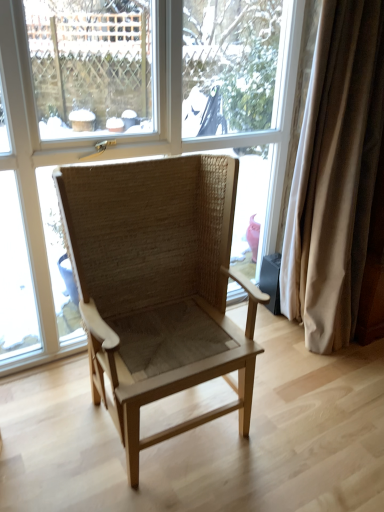
Question: Considering the positions of point (291, 240) and point (92, 244), is point (291, 240) closer or farther from the camera than point (92, 244)?

Choices:
 (A) farther
 (B) closer

Answer: (A)

Question: In terms of width, does beige fabric curtain at right look wider or thinner when compared to natural woven chair at center?

Choices:
 (A) wide
 (B) thin

Answer: (B)

Question: Based on their relative distances, which object is nearer to the natural woven chair at center?

Choices:
 (A) beige fabric curtain at right
 (B) transparent glass window at center

Answer: (B)

Question: Which object is positioned farthest from the transparent glass window at center?

Choices:
 (A) natural woven chair at center
 (B) beige fabric curtain at right

Answer: (B)